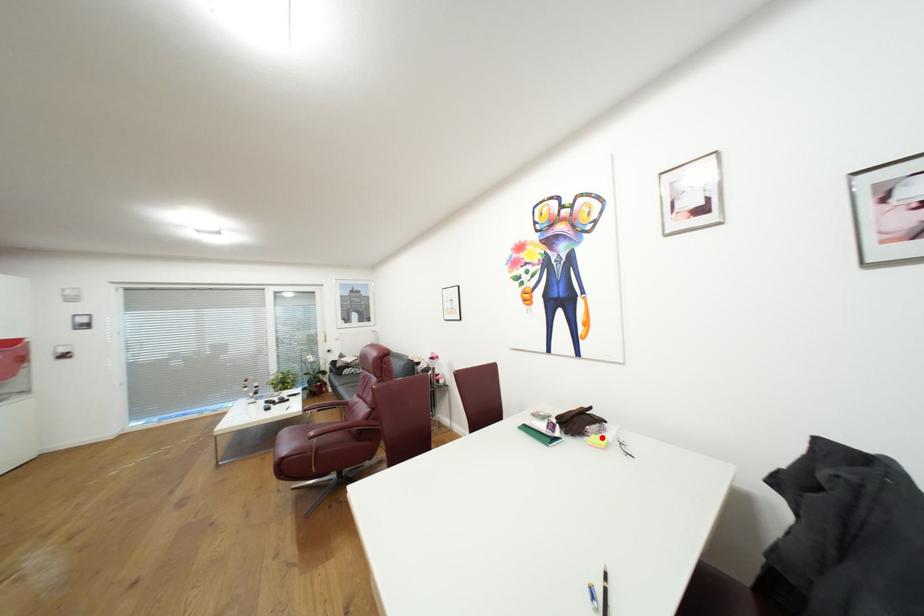
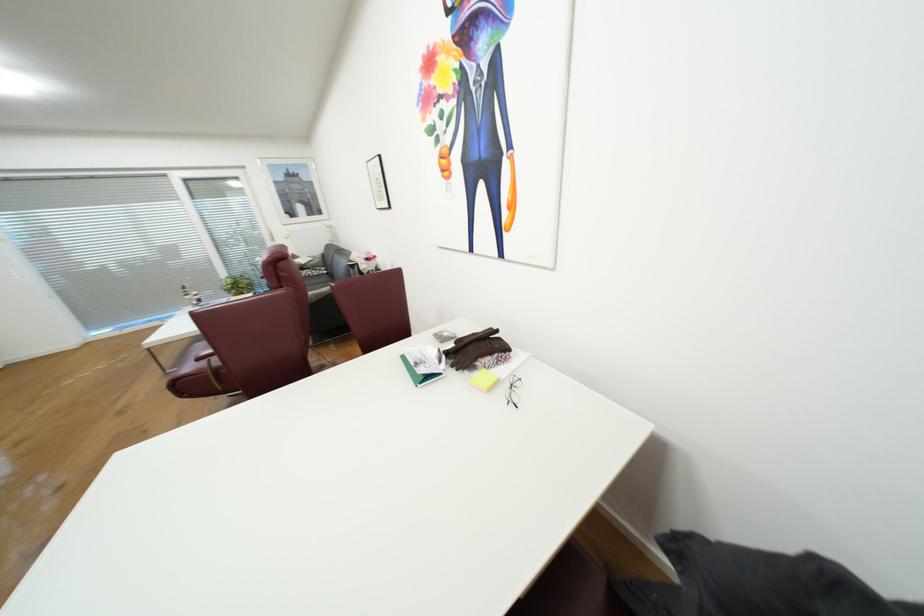
In the second image, find the point that corresponds to the highlighted location in the first image.

(492, 373)